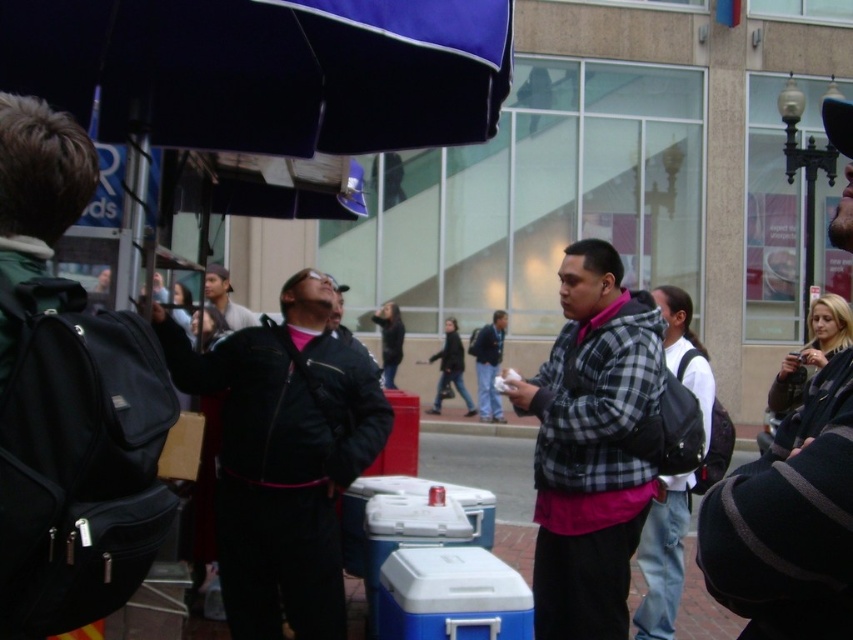
Can you confirm if plaid fabric jacket at center is taller than plaid wool jacket at center?

Correct, plaid fabric jacket at center is much taller as plaid wool jacket at center.

Who is more distant from viewer, (639,333) or (836,240)?

Positioned behind is point (639,333).

Locate an element on the screen. plaid fabric jacket at center is located at coordinates (590, 445).

Describe the element at coordinates (283, 456) in the screenshot. This screenshot has width=853, height=640. I see `black matte jacket at center` at that location.

This screenshot has height=640, width=853. Find the location of `black matte jacket at center`. black matte jacket at center is located at coordinates (283, 456).

Is plaid fabric jacket at center above white plastic cooler at center?

Yes.

Is plaid fabric jacket at center closer to the viewer compared to white plastic cooler at center?

No, plaid fabric jacket at center is behind white plastic cooler at center.

Who is more distant from viewer, (573, 624) or (459, 577)?

Point (573, 624)

The height and width of the screenshot is (640, 853). I want to click on plaid fabric jacket at center, so click(x=590, y=445).